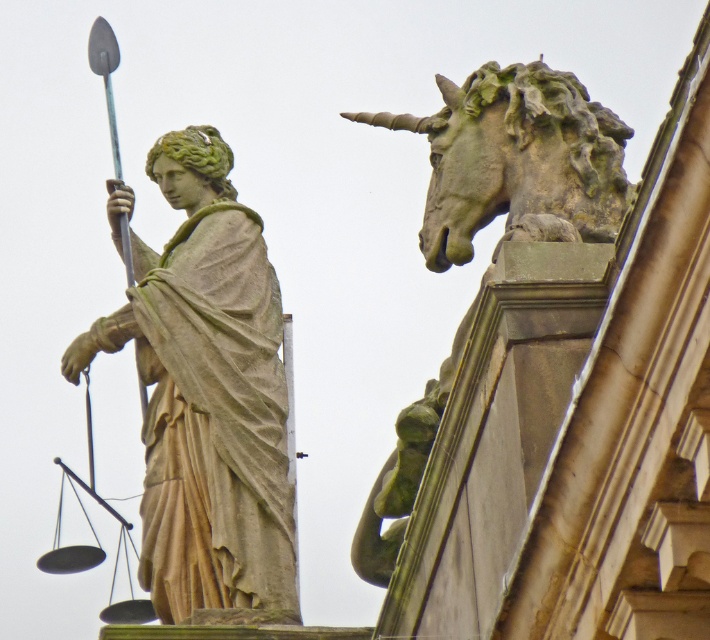
Does matte stone statue at left appear on the right side of stone unicorn head at upper right?

In fact, matte stone statue at left is to the left of stone unicorn head at upper right.

Identify the location of matte stone statue at left. The image size is (710, 640). (207, 394).